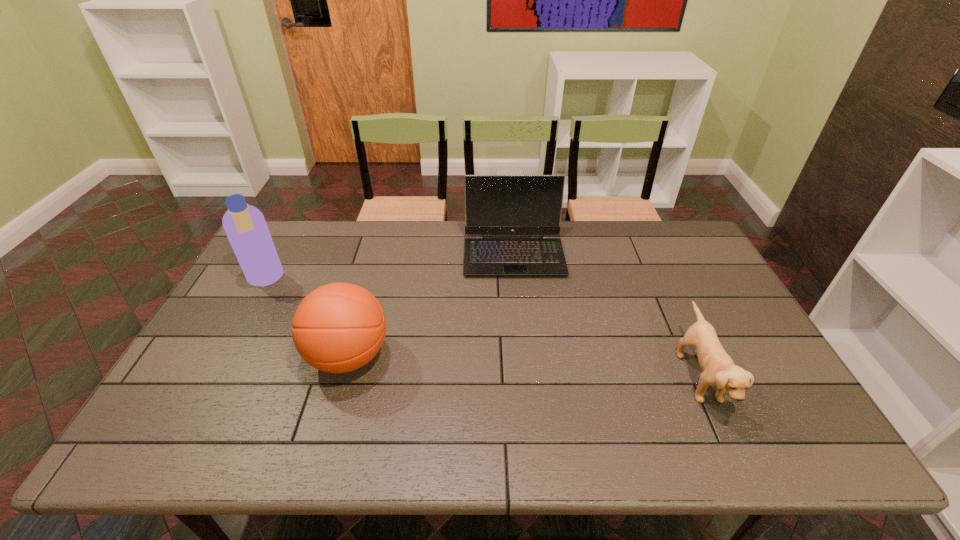
Find the location of `free space located on the left side of the puppy`. free space located on the left side of the puppy is located at coordinates (557, 377).

Image resolution: width=960 pixels, height=540 pixels. In order to click on free space located on the left side of the puppy in this screenshot , I will do `click(639, 377)`.

In order to click on object at the far edge in this screenshot , I will do `click(531, 205)`.

I want to click on object present at the near edge, so click(x=719, y=369).

Find the location of a particular element. object that is at the left edge is located at coordinates (245, 226).

This screenshot has width=960, height=540. What are the coordinates of `vacant space at the far edge of the desktop` in the screenshot? It's located at (604, 220).

Where is `vacant space at the near edge of the desktop`? vacant space at the near edge of the desktop is located at coordinates (678, 430).

The height and width of the screenshot is (540, 960). In order to click on vacant region at the left edge of the desktop in this screenshot , I will do `click(176, 387)`.

This screenshot has width=960, height=540. In the image, there is a desktop. What are the coordinates of `vacant space at the right edge` in the screenshot? It's located at (699, 271).

The image size is (960, 540). Identify the location of vacant region at the far left corner of the desktop. (278, 251).